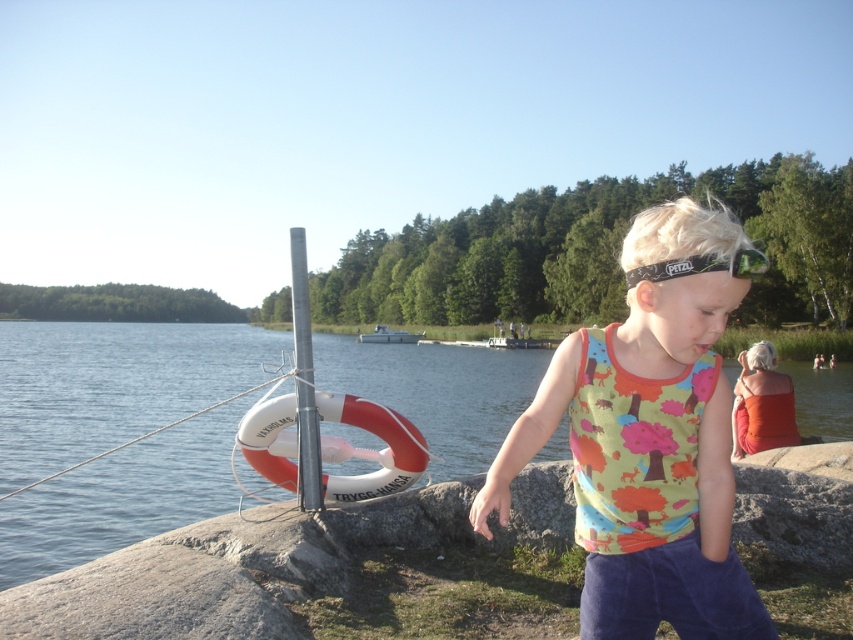
In the scene shown: Is white rubber lifebuoy at left thinner than silver metallic pole at center?

No, white rubber lifebuoy at left is not thinner than silver metallic pole at center.

Does white rubber lifebuoy at left have a lesser height compared to silver metallic pole at center?

No.

Which is in front, point (503, 394) or point (291, 269)?

Point (291, 269)

The height and width of the screenshot is (640, 853). I want to click on white rubber lifebuoy at left, so click(113, 384).

Which is above, multicolored fabric tank top at center or orange fabric dress at right?

Positioned higher is multicolored fabric tank top at center.

Can you confirm if multicolored fabric tank top at center is wider than orange fabric dress at right?

Incorrect, multicolored fabric tank top at center's width does not surpass orange fabric dress at right's.

Which is in front, point (720, 252) or point (785, 440)?

Positioned in front is point (720, 252).

Where is `multicolored fabric tank top at center`? multicolored fabric tank top at center is located at coordinates 645,465.

Can you confirm if multicolored fabric tank top at center is wider than white plastic boat at center?

In fact, multicolored fabric tank top at center might be narrower than white plastic boat at center.

Is multicolored fabric tank top at center above white plastic boat at center?

Incorrect, multicolored fabric tank top at center is not positioned above white plastic boat at center.

Does point (717, 413) come farther from viewer compared to point (374, 337)?

No, (717, 413) is closer to viewer.

Find the location of `multicolored fabric tank top at center`. multicolored fabric tank top at center is located at coordinates (645, 465).